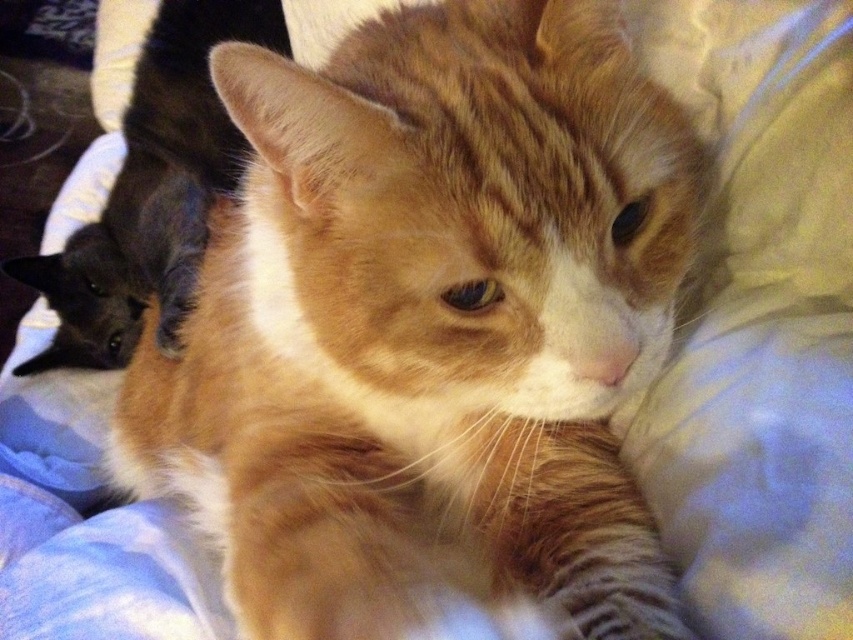
Question: Does orange tabby cat at center lie behind black glossy cat at left?

Choices:
 (A) yes
 (B) no

Answer: (B)

Question: Among these objects, which one is farthest from the camera?

Choices:
 (A) orange tabby cat at center
 (B) black glossy cat at left

Answer: (B)

Question: Can you confirm if orange tabby cat at center is positioned to the right of black glossy cat at left?

Choices:
 (A) yes
 (B) no

Answer: (A)

Question: Is orange tabby cat at center positioned in front of black glossy cat at left?

Choices:
 (A) no
 (B) yes

Answer: (B)